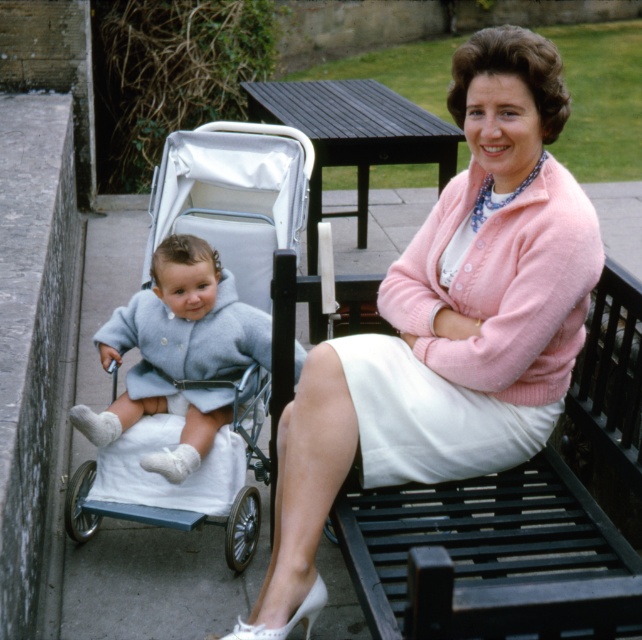
Can you confirm if pink woolen cardigan at upper right is thinner than white fabric skirt at center?

In fact, pink woolen cardigan at upper right might be wider than white fabric skirt at center.

Is pink woolen cardigan at upper right to the right of white fabric skirt at center from the viewer's perspective?

In fact, pink woolen cardigan at upper right is to the left of white fabric skirt at center.

At what (x,y) coordinates should I click in order to perform the action: click on pink woolen cardigan at upper right. Please return your answer as a coordinate pair (x, y). Looking at the image, I should click on (447, 324).

Where is `pink woolen cardigan at upper right`? This screenshot has height=640, width=642. pink woolen cardigan at upper right is located at coordinates (447, 324).

Can you confirm if pink woolen cardigan at upper right is taller than light blue fabric baby carriage at left?

Yes.

Looking at this image, who is more forward, (462, 266) or (107, 492)?

Positioned in front is point (462, 266).

Where is `pink woolen cardigan at upper right`? The width and height of the screenshot is (642, 640). pink woolen cardigan at upper right is located at coordinates (447, 324).

Consider the image. Does light blue fabric baby carriage at left appear on the right side of white fabric skirt at center?

In fact, light blue fabric baby carriage at left is to the left of white fabric skirt at center.

Based on the photo, can you confirm if light blue fabric baby carriage at left is bigger than white fabric skirt at center?

Indeed, light blue fabric baby carriage at left has a larger size compared to white fabric skirt at center.

You are a GUI agent. You are given a task and a screenshot of the screen. Output one action in this format:
    pyautogui.click(x=<x>, y=<y>)
    Task: Click on the light blue fabric baby carriage at left
    This screenshot has height=640, width=642.
    Given the screenshot: What is the action you would take?
    (202, 337)